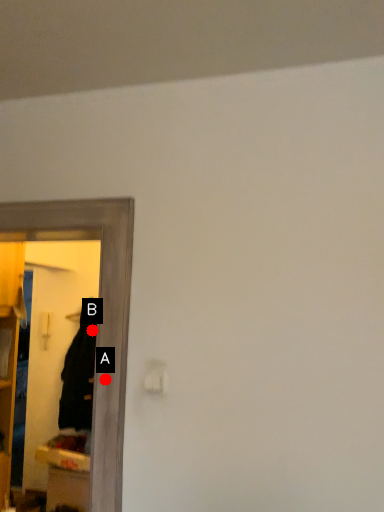
Question: Two points are circled on the image, labeled by A and B beside each circle. Which point is farther from the camera taking this photo?

Choices:
 (A) A is further
 (B) B is further

Answer: (B)